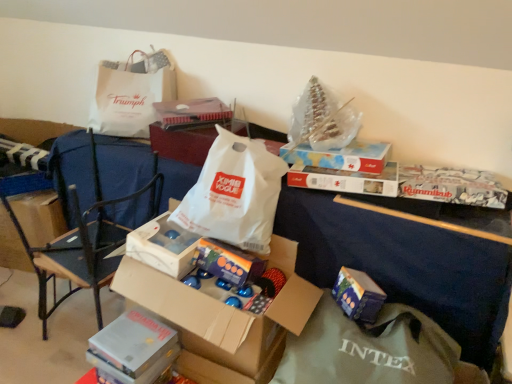
The height and width of the screenshot is (384, 512). Find the location of `vacant space situated above matte cardboard box at upper center, positioned as the fourth storage box in bottom-to-top order (from a real-world perspective)`. vacant space situated above matte cardboard box at upper center, positioned as the fourth storage box in bottom-to-top order (from a real-world perspective) is located at coordinates (344, 145).